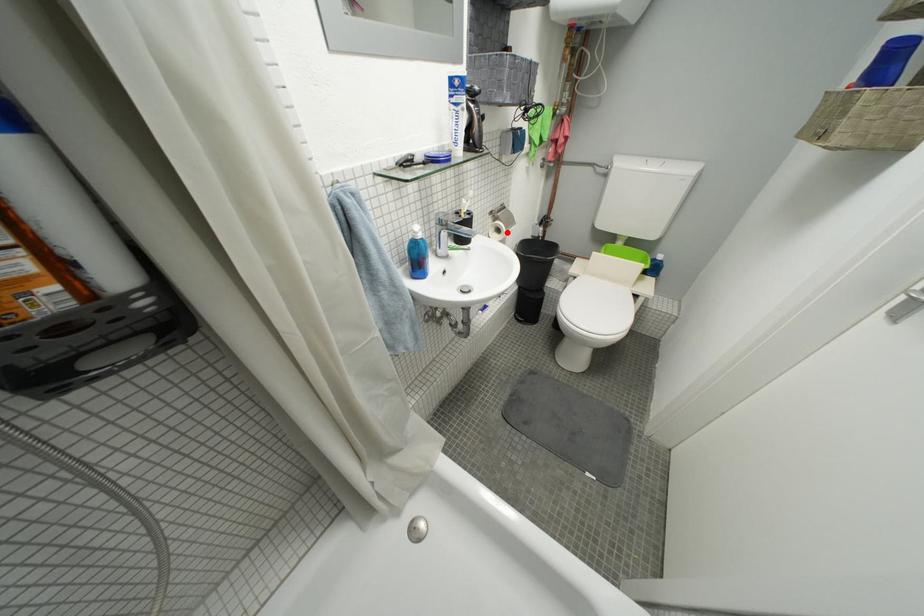
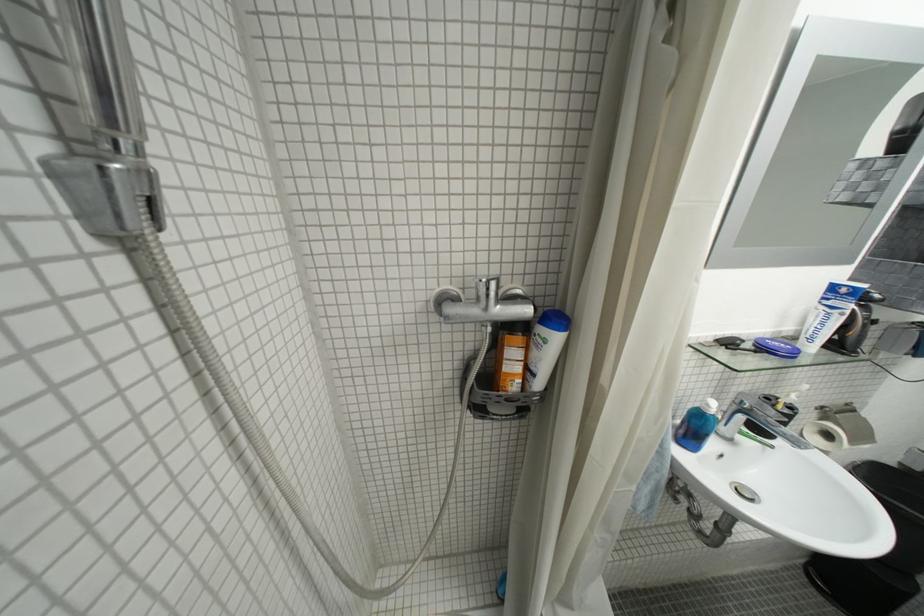
The point at the highlighted location is marked in the first image. Where is the corresponding point in the second image?

(836, 438)